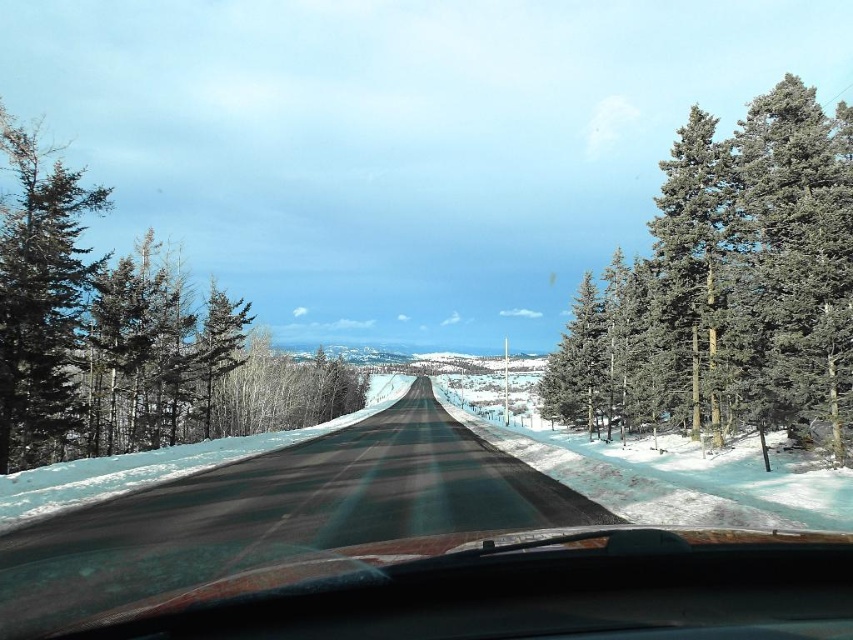
Question: Which point appears farthest from the camera in this image?

Choices:
 (A) (79, 264)
 (B) (144, 296)
 (C) (456, 456)
 (D) (784, 236)

Answer: (B)

Question: Considering the real-world distances, which object is farthest from the green matte tree at left?

Choices:
 (A) green textured pine trees at right
 (B) asphalt road at center

Answer: (A)

Question: In this image, where is asphalt road at center located relative to green matte tree at left?

Choices:
 (A) right
 (B) left

Answer: (A)

Question: Can you confirm if green textured pine tree at left is wider than green matte tree at left?

Choices:
 (A) no
 (B) yes

Answer: (B)

Question: Which is nearer to the green matte tree at left?

Choices:
 (A) green textured pine tree at left
 (B) asphalt road at center
 (C) green textured pine trees at right

Answer: (A)

Question: Does green textured pine trees at right appear on the left side of green textured pine tree at left?

Choices:
 (A) no
 (B) yes

Answer: (A)